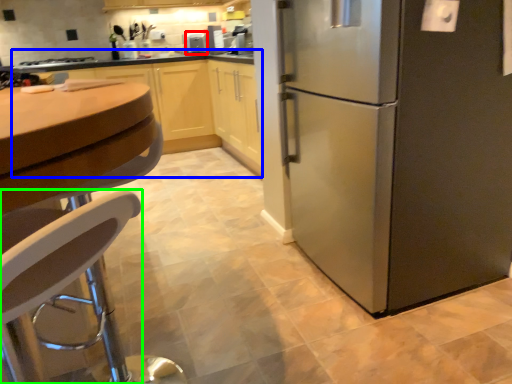
Question: Which is nearer to the appliance (highlighted by a red box)? cabinetry (highlighted by a blue box) or chair (highlighted by a green box).

Choices:
 (A) cabinetry
 (B) chair

Answer: (A)